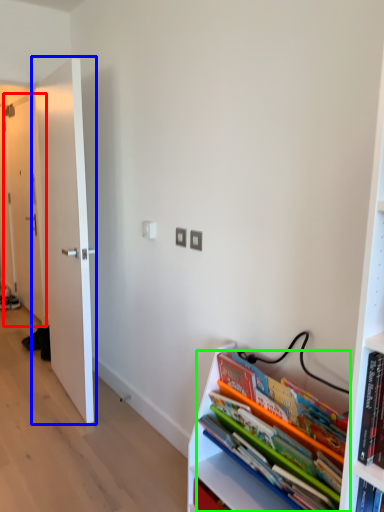
Question: Estimate the real-world distances between objects in this image. Which object is closer to door (highlighted by a red box), door (highlighted by a blue box) or book (highlighted by a green box)?

Choices:
 (A) door
 (B) book

Answer: (A)